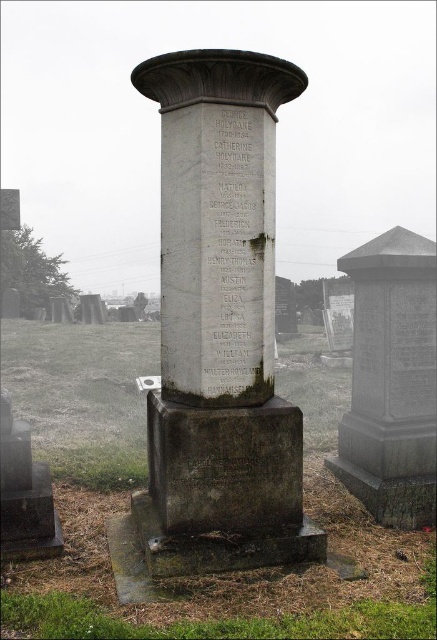
Looking at this image, you are standing at the entrance of the cemetery and want to locate the granite stone monument at center. According to the coordinates provided, where should you look relative to your current position?

The granite stone monument at center is located at coordinates point (391, 380), which places it slightly to the right and lower portion of your field of view from the entrance.

You are standing in front of the cemetery scene. There are two objects here. One is the granite stone column at center and the other is the black stone inscription at lower center. Which object is closer to you?

The granite stone column at center is closer to you because it is in front of the black stone inscription at lower center.